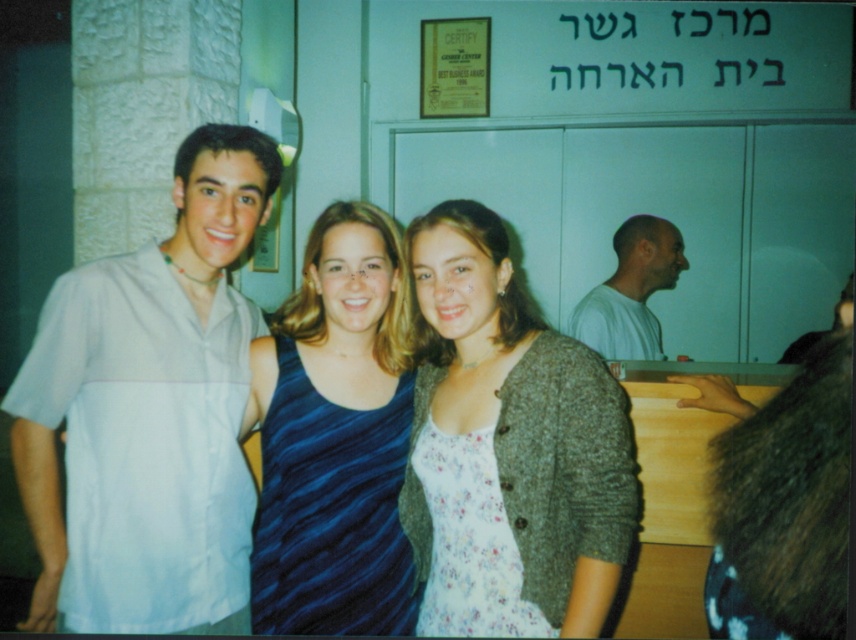
Question: Which object is farther from the camera taking this photo?

Choices:
 (A) floral cotton dress at center
 (B) white cotton shirt at left
 (C) white cotton shirt at right
 (D) blue striped tank top at center

Answer: (C)

Question: Can you confirm if blue striped tank top at center is positioned to the right of white cotton shirt at right?

Choices:
 (A) yes
 (B) no

Answer: (B)

Question: Which point is farther to the camera?

Choices:
 (A) (541, 584)
 (B) (286, 440)
 (C) (681, 250)

Answer: (C)

Question: Is white cotton shirt at left above floral cotton dress at center?

Choices:
 (A) no
 (B) yes

Answer: (B)

Question: Based on their relative distances, which object is farther from the white cotton shirt at right?

Choices:
 (A) white cotton shirt at left
 (B) floral cotton dress at center
 (C) blue striped tank top at center

Answer: (A)

Question: Is white cotton shirt at left bigger than floral cotton dress at center?

Choices:
 (A) no
 (B) yes

Answer: (B)